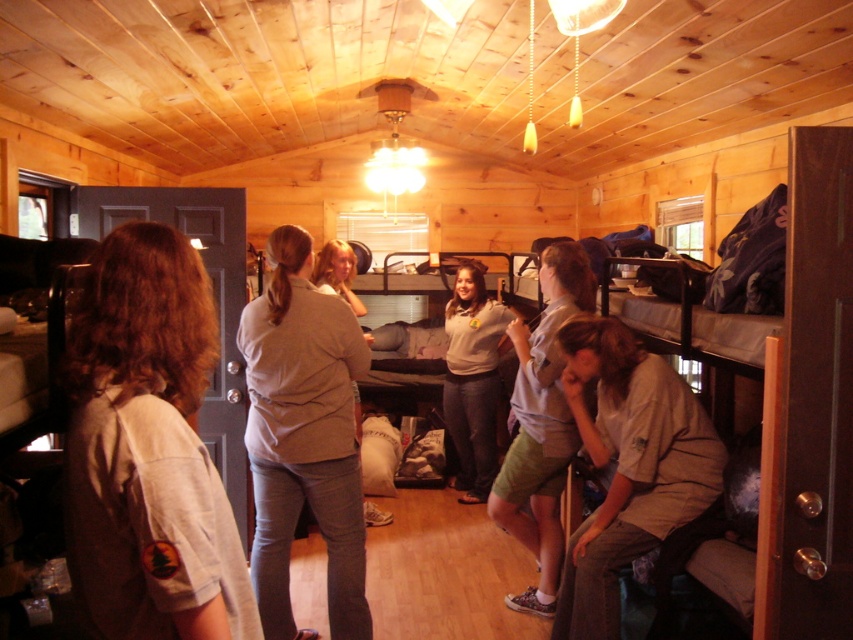
Question: Among these objects, which one is nearest to the camera?

Choices:
 (A) matte khaki shirt at center
 (B) gray cotton shirt at lower right

Answer: (B)

Question: Which point is closer to the camera taking this photo?

Choices:
 (A) (303, 376)
 (B) (459, 300)

Answer: (A)

Question: Does light gray uniform at center appear under blonde hair at center?

Choices:
 (A) yes
 (B) no

Answer: (A)

Question: Is gray cotton shirt at lower right to the right of matte khaki shirt at center from the viewer's perspective?

Choices:
 (A) yes
 (B) no

Answer: (A)

Question: Which object is closer to the camera taking this photo?

Choices:
 (A) blonde hair at center
 (B) tan fabric shirt at center
 (C) light brown uniform at left

Answer: (C)

Question: Does light brown uniform at left have a larger size compared to light gray uniform at center?

Choices:
 (A) no
 (B) yes

Answer: (A)